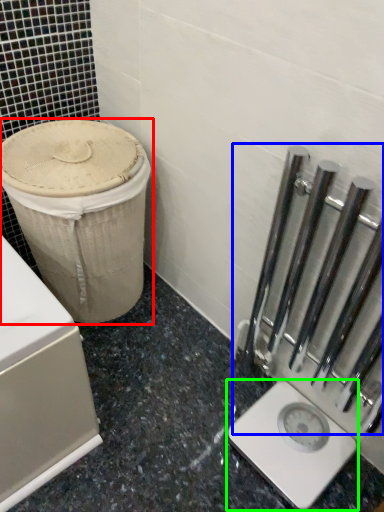
Question: Which object is positioned closest to waste container (highlighted by a red box)? Select from rail (highlighted by a blue box) and scale (highlighted by a green box).

Choices:
 (A) rail
 (B) scale

Answer: (A)